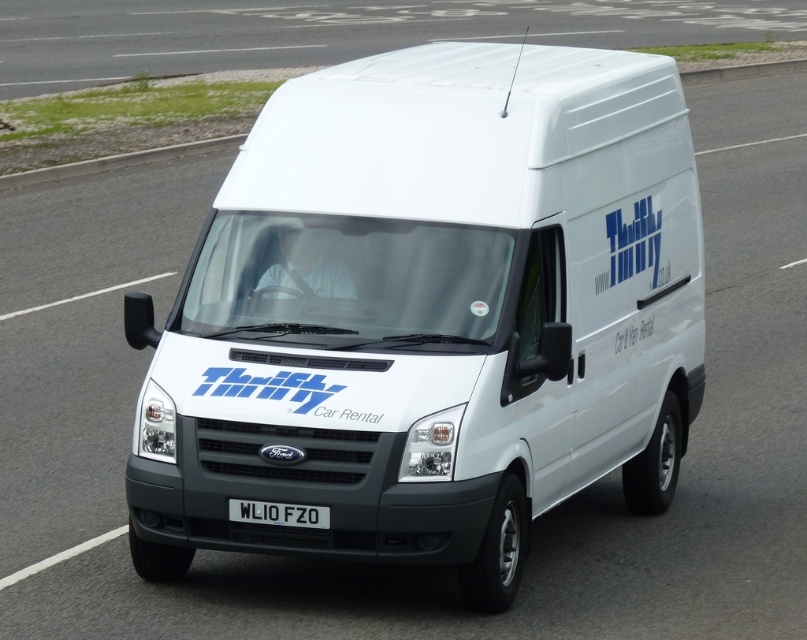
You are a delivery driver who needs to check the license plate of the van you are driving. Based on the scene, can you see the black plastic license plate at center while looking at the white smooth roof at upper center?

The white smooth roof at upper center is closer to you than the black plastic license plate at center, so you cannot see the black plastic license plate at center while looking at the white smooth roof at upper center because it is further away.

You are a delivery driver who needs to place a GPS tracker on the white matte van at center. The GPS tracker must be placed at the point with coordinates point (429, 314). Where exactly on the white matte van at center should you place the GPS tracker?

The point (429, 314) is located on the white matte van at center, so you should place the GPS tracker on that specific area of the van.